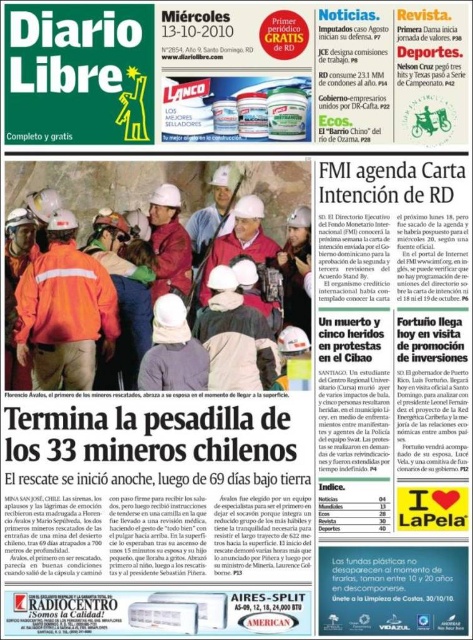
You are a graphic designer working on a layout for a new article. You need to place a text box that will cover the orange fabric safety vest at center. What are the coordinates where you should position the text box?

The orange fabric safety vest at center is located at coordinates point [63,310], so you should position the text box at those coordinates to cover it.